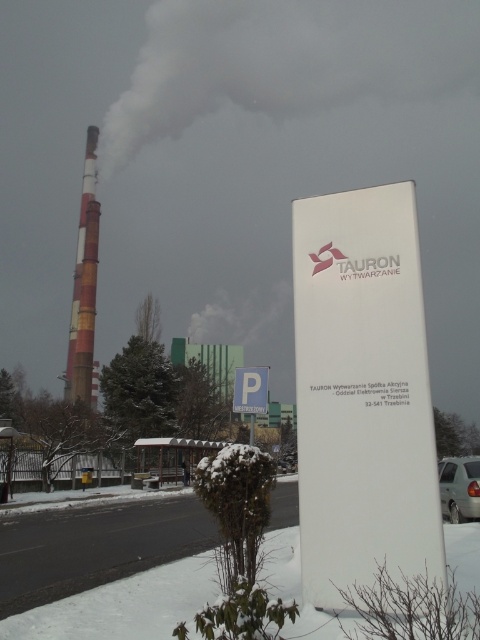
You are a delivery driver approaching the industrial site and see the red and white striped chimney at left and the blue plastic parking sign at center. Which object is higher from the ground?

The red and white striped chimney at left is positioned over the blue plastic parking sign at center, so the chimney is higher from the ground than the parking sign.

You are a drone operator tasked with taking aerial photos of the red and white striped chimney at left. Your drone has a camera with a 50mm lens. To ensure the chimney fills the frame, you need to position the drone at a distance where the center of the lens aligns with the chimney. Given the chimney is 100 meters tall, what is the minimum distance you should maintain between the drone and the chimney to achieve this?

The minimum distance should be calculated using the lens formula, but since the chimney is 100 meters tall and the lens focal length is 50mm, the drone should be positioned at least 50 meters away to ensure the chimney fills the frame without distortion.

You are a drone operator tasked with inspecting the white smoke at upper center and the red and white striped chimney at left. From your current position, which object is higher in the image?

The white smoke at upper center is higher than the red and white striped chimney at left because it is located above it.